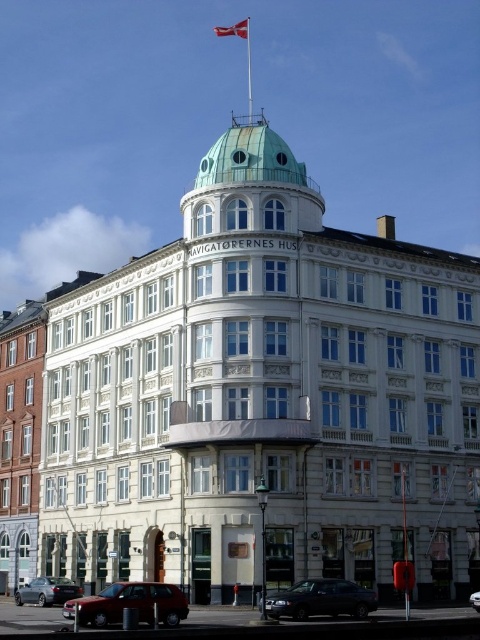
Question: Does red fabric flag at upper center appear on the left side of metallic silver car at center?

Choices:
 (A) yes
 (B) no

Answer: (A)

Question: Which point is closer to the camera?

Choices:
 (A) (151, 600)
 (B) (20, 449)

Answer: (A)

Question: Which of the following is the closest to the observer?

Choices:
 (A) (337, 602)
 (B) (231, 35)
 (C) (61, 582)

Answer: (A)

Question: Which point is farther to the camera?

Choices:
 (A) red fabric flag at upper center
 (B) white glossy building at center

Answer: (A)

Question: Does white glossy building at center have a smaller size compared to shiny black sedan at lower center?

Choices:
 (A) yes
 (B) no

Answer: (B)

Question: Can you confirm if metallic silver car at lower left is smaller than matte black sedan at lower left?

Choices:
 (A) yes
 (B) no

Answer: (B)